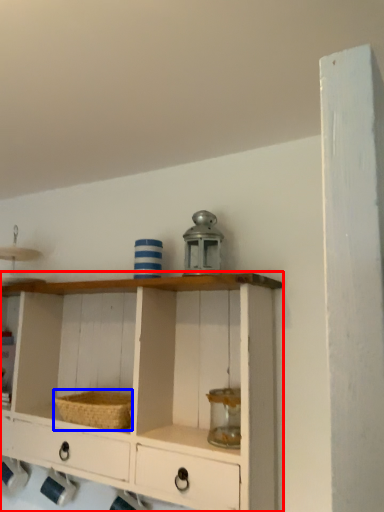
Question: Among these objects, which one is nearest to the camera, shelf (highlighted by a red box) or basket (highlighted by a blue box)?

Choices:
 (A) shelf
 (B) basket

Answer: (A)